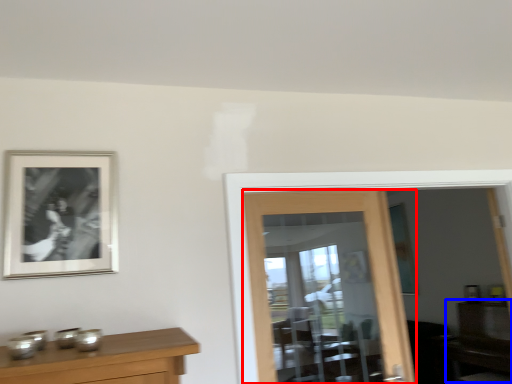
Question: Which object is closer to the camera taking this photo, door (highlighted by a red box) or dresser (highlighted by a blue box)?

Choices:
 (A) door
 (B) dresser

Answer: (A)